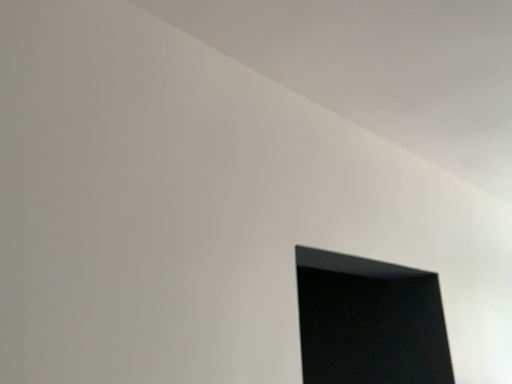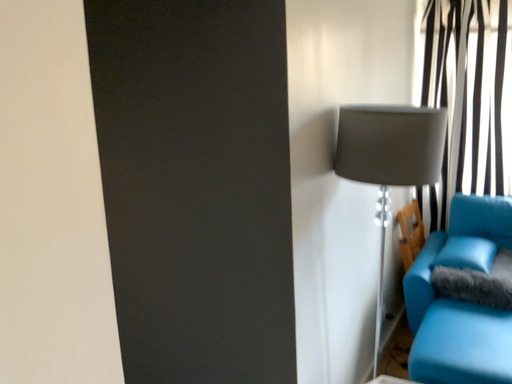
Question: How did the camera likely rotate when shooting the video?

Choices:
 (A) rotated left
 (B) rotated right

Answer: (B)